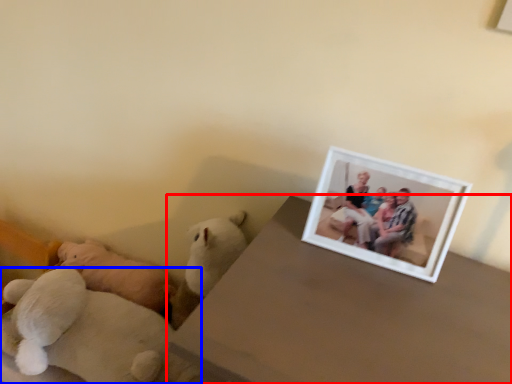
Question: Among these objects, which one is nearest to the camera, table (highlighted by a red box) or teddy bear (highlighted by a blue box)?

Choices:
 (A) table
 (B) teddy bear

Answer: (A)